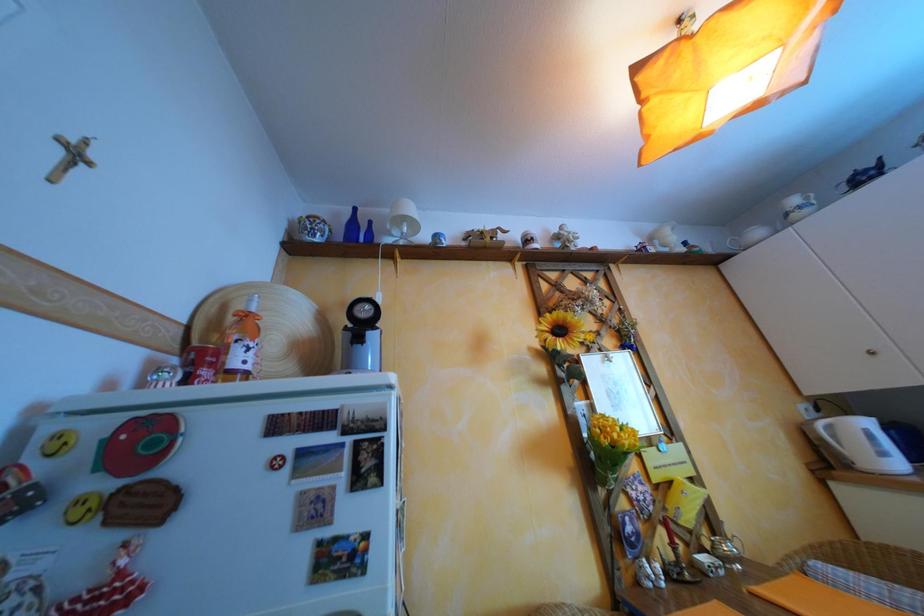
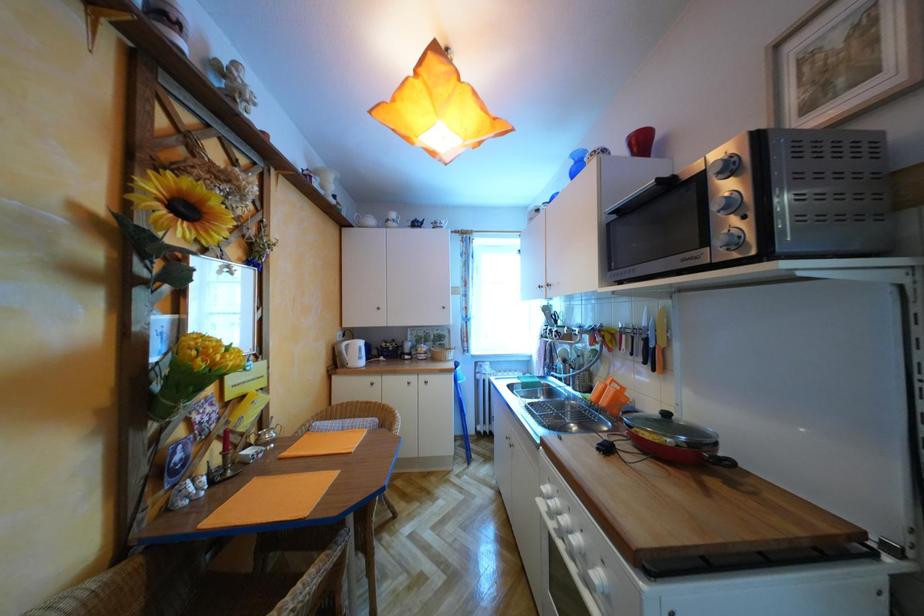
Question: The camera is either moving clockwise (left) or counter-clockwise (right) around the object. The first image is from the beginning of the video and the second image is from the end. Is the camera moving left or right when shooting the video?

Choices:
 (A) Left
 (B) Right

Answer: (A)